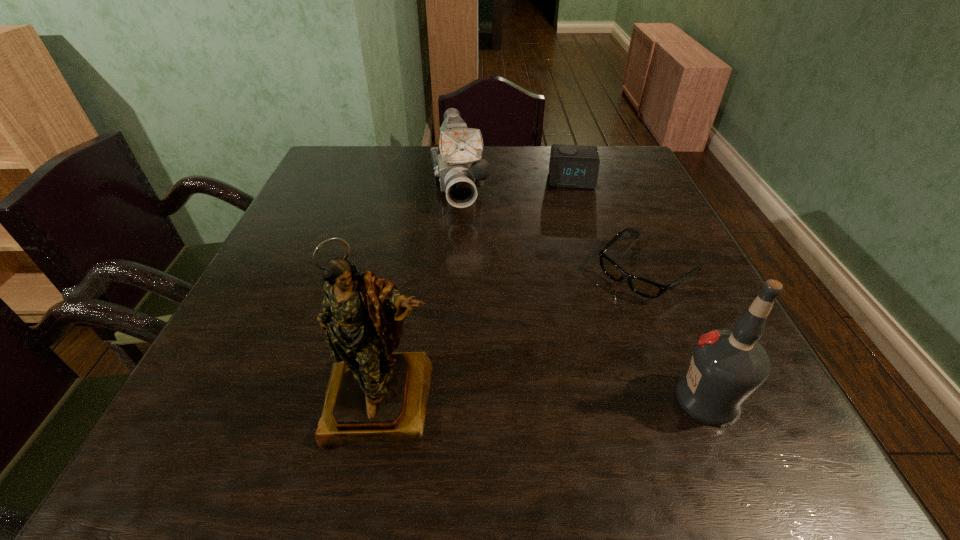
Locate an element on the screen. The width and height of the screenshot is (960, 540). free space on the desktop that is between the tallest object and the vodka and is positioned on the front-facing side of the second shortest object is located at coordinates (589, 399).

This screenshot has width=960, height=540. Find the location of `free space on the desktop that is between the tallest object and the vodka and is positioned on the front-facing side of the third tallest object`. free space on the desktop that is between the tallest object and the vodka and is positioned on the front-facing side of the third tallest object is located at coordinates (498, 399).

What are the coordinates of `vacant spot on the desktop that is between the tallest object and the second tallest object and is positioned on the front-facing side of the third nearest object` in the screenshot? It's located at (497, 399).